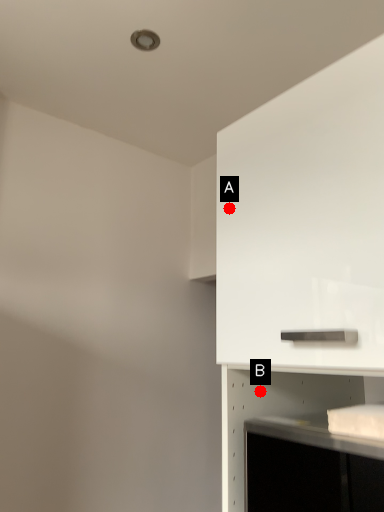
Question: Two points are circled on the image, labeled by A and B beside each circle. Which point appears closest to the camera in this image?

Choices:
 (A) A is closer
 (B) B is closer

Answer: (A)